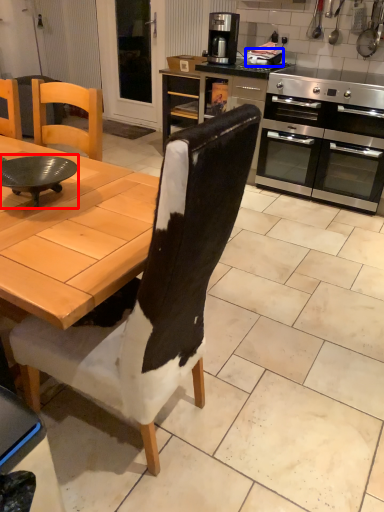
Question: Which object is closer to the camera taking this photo, round table (highlighted by a red box) or appliance (highlighted by a blue box)?

Choices:
 (A) round table
 (B) appliance

Answer: (A)